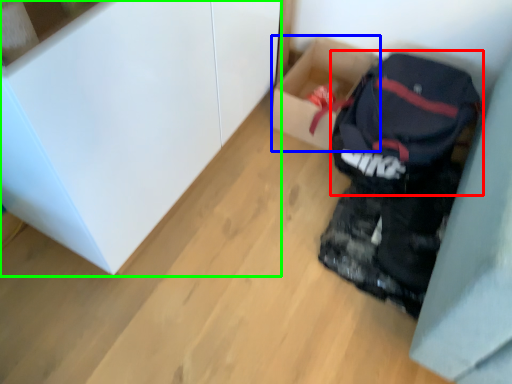
Question: Estimate the real-world distances between objects in this image. Which object is farther from backpack (highlighted by a red box), box (highlighted by a blue box) or cabinetry (highlighted by a green box)?

Choices:
 (A) box
 (B) cabinetry

Answer: (B)